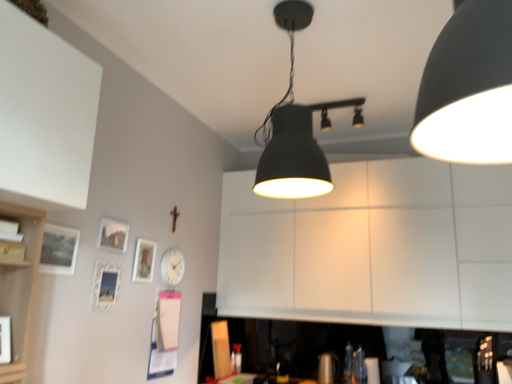
Question: Looking at the image, does white matte cabinet at center seem bigger or smaller compared to matte glass picture frame at lower left, placed as the 3th picture frame when sorted from front to back?

Choices:
 (A) big
 (B) small

Answer: (A)

Question: From a real-world perspective, is white matte cabinet at center positioned above or below matte glass picture frame at lower left, placed as the 3th picture frame when sorted from front to back?

Choices:
 (A) below
 (B) above

Answer: (B)

Question: Which of these objects is positioned closest to the matte black lampshade at center, the 1th lamp viewed from the left?

Choices:
 (A) white matte cabinet at center
 (B) matte glass picture frame at lower left, placed as the 3th picture frame when sorted from front to back
 (C) white matte clock at lower left
 (D) white glossy picture frame at lower left, the second picture frame from the front
 (E) matte black track lights at upper center, placed as the 2th lamp when sorted from front to back

Answer: (B)

Question: Considering the real-world distances, which object is closest to the matte glass picture frame at upper left, the fourth picture frame positioned from the front?

Choices:
 (A) matte black track lights at upper center, arranged as the 1th lamp when viewed from the right
 (B) white matte clock at lower left
 (C) white glossy picture frame at lower left, the second picture frame from the front
 (D) matte black lampshade at center, the second lamp positioned from the back
 (E) white matte cabinet at center

Answer: (B)